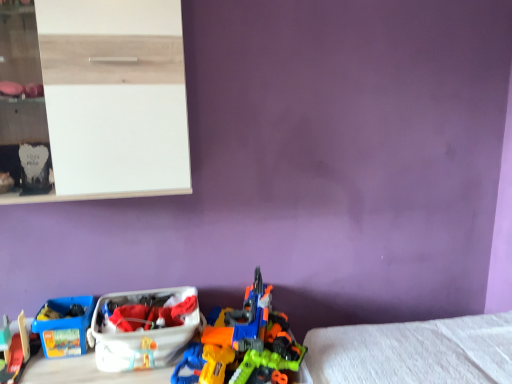
Question: Can you confirm if blue plastic storage box at lower left, which is the 2th storage box in right-to-left order, is shorter than orange plastic toy gun at center, the 2th toy positioned from the left?

Choices:
 (A) yes
 (B) no

Answer: (A)

Question: Is orange plastic toy gun at center, the 2th toy positioned from the left, at the back of blue plastic storage box at lower left, the 1th storage box in the left-to-right sequence?

Choices:
 (A) yes
 (B) no

Answer: (B)

Question: Is blue plastic storage box at lower left, which is the 2th storage box in right-to-left order, next to orange plastic toy gun at center, the 2th toy positioned from the left, and touching it?

Choices:
 (A) yes
 (B) no

Answer: (B)

Question: Is blue plastic storage box at lower left, which is the 2th storage box in right-to-left order, positioned beyond the bounds of orange plastic toy gun at center, the 2th toy positioned from the left?

Choices:
 (A) no
 (B) yes

Answer: (B)

Question: Can you confirm if blue plastic storage box at lower left, the 1th storage box in the left-to-right sequence, is bigger than orange plastic toy gun at center, which is the 1th toy in right-to-left order?

Choices:
 (A) no
 (B) yes

Answer: (A)

Question: From the image's perspective, is blue plastic storage box at lower left, the 1th storage box in the left-to-right sequence, under orange plastic toy gun at center, which is the 1th toy in right-to-left order?

Choices:
 (A) yes
 (B) no

Answer: (A)

Question: Is smooth plastic toy train at lower left, the 2th toy when ordered from right to left, at the left side of orange plastic toy gun at center, the 2th toy positioned from the left?

Choices:
 (A) yes
 (B) no

Answer: (A)

Question: Is smooth plastic toy train at lower left, which is the first toy from left to right, aimed at orange plastic toy gun at center, the 2th toy positioned from the left?

Choices:
 (A) no
 (B) yes

Answer: (A)

Question: Are smooth plastic toy train at lower left, the 2th toy when ordered from right to left, and orange plastic toy gun at center, the 2th toy positioned from the left, located far from each other?

Choices:
 (A) no
 (B) yes

Answer: (A)

Question: From a real-world perspective, is smooth plastic toy train at lower left, the 2th toy when ordered from right to left, physically above orange plastic toy gun at center, which is the 1th toy in right-to-left order?

Choices:
 (A) yes
 (B) no

Answer: (B)

Question: Does smooth plastic toy train at lower left, the 2th toy when ordered from right to left, have a greater width compared to orange plastic toy gun at center, which is the 1th toy in right-to-left order?

Choices:
 (A) yes
 (B) no

Answer: (B)

Question: From the image's perspective, is smooth plastic toy train at lower left, the 2th toy when ordered from right to left, over orange plastic toy gun at center, the 2th toy positioned from the left?

Choices:
 (A) no
 (B) yes

Answer: (A)

Question: Is blue plastic storage box at lower left, which is the 2th storage box in right-to-left order, to the right of white glossy shelf at upper left from the viewer's perspective?

Choices:
 (A) no
 (B) yes

Answer: (A)